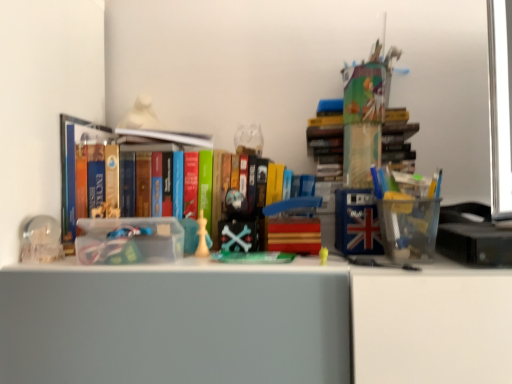
Question: Considering the positions of white paper at center, acting as the second book starting from the bottom, and matte white bust at upper center, arranged as the 5th toy when viewed from the right, in the image, is white paper at center, acting as the second book starting from the bottom, bigger or smaller than matte white bust at upper center, arranged as the 5th toy when viewed from the right,?

Choices:
 (A) big
 (B) small

Answer: (B)

Question: Is white paper at center, acting as the second book starting from the bottom, inside the boundaries of matte white bust at upper center, which is the 5th toy from front to back, or outside?

Choices:
 (A) outside
 (B) inside

Answer: (A)

Question: Estimate the real-world distances between objects in this image. Which object is closer to the clear plastic container at left?

Choices:
 (A) white paper at center, marked as the 1th book in a top-to-bottom arrangement
 (B) matte white bust at upper center, which ranks as the first toy in top-to-bottom order
 (C) shiny plastic skull at center, the second toy viewed from the top
 (D) hardcover books at left, which is the 1th book in bottom-to-top order
 (E) wooden block at center, which is counted as the second toy, starting from the front

Answer: (D)

Question: Which of these objects is positioned closest to the white paper at center, acting as the second book starting from the bottom?

Choices:
 (A) hardcover books at left, which ranks as the second book in top-to-bottom order
 (B) clear plastic container at left
 (C) matte yellow chess piece at center, the third toy when ordered from front to back
 (D) wooden block at center, which is counted as the second toy, starting from the front
 (E) yellow matte toy at center, positioned as the first toy in bottom-to-top order

Answer: (A)